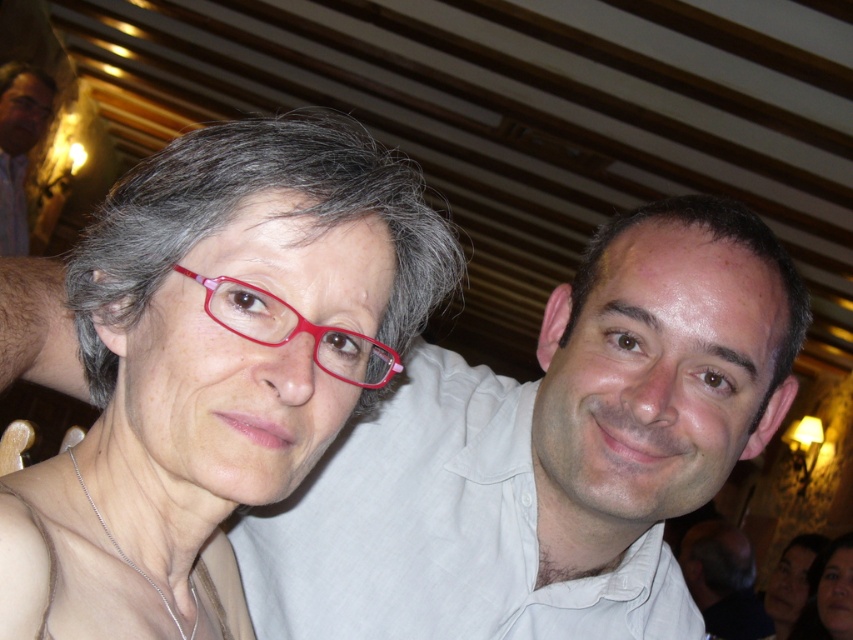
Looking at this image, is white smooth shirt at center positioned at the back of matte black shirt at upper left?

No, white smooth shirt at center is closer to the viewer.

Who is positioned more to the left, white smooth shirt at center or matte black shirt at upper left?

matte black shirt at upper left

Describe the element at coordinates (548, 454) in the screenshot. I see `white smooth shirt at center` at that location.

Locate an element on the screen. This screenshot has width=853, height=640. white smooth shirt at center is located at coordinates (548, 454).

Between white smooth shirt at center and matte plastic glasses at center, which one is positioned higher?

matte plastic glasses at center is higher up.

Can you confirm if white smooth shirt at center is thinner than matte plastic glasses at center?

No, white smooth shirt at center is not thinner than matte plastic glasses at center.

This screenshot has width=853, height=640. Describe the element at coordinates (548, 454) in the screenshot. I see `white smooth shirt at center` at that location.

Where is `white smooth shirt at center`? This screenshot has width=853, height=640. white smooth shirt at center is located at coordinates (548, 454).

Which is more to the right, matte pink glasses at upper left or matte plastic glasses at center?

From the viewer's perspective, matte plastic glasses at center appears more on the right side.

Consider the image. Does matte pink glasses at upper left have a greater height compared to matte plastic glasses at center?

Correct, matte pink glasses at upper left is much taller as matte plastic glasses at center.

Is point (454, 253) behind point (242, 292)?

Yes, point (454, 253) is behind point (242, 292).

I want to click on matte pink glasses at upper left, so tap(236, 330).